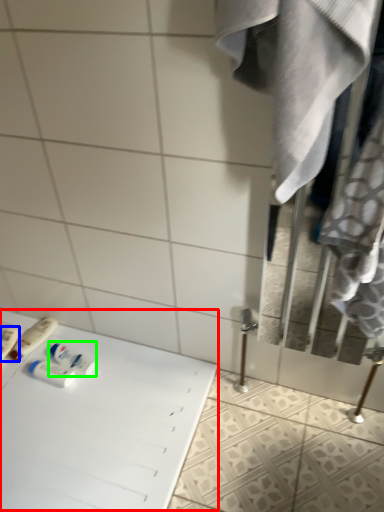
Question: Considering the real-world distances, which object is closest to table (highlighted by a red box)? toiletry (highlighted by a blue box) or mouthwash (highlighted by a green box).

Choices:
 (A) toiletry
 (B) mouthwash

Answer: (B)